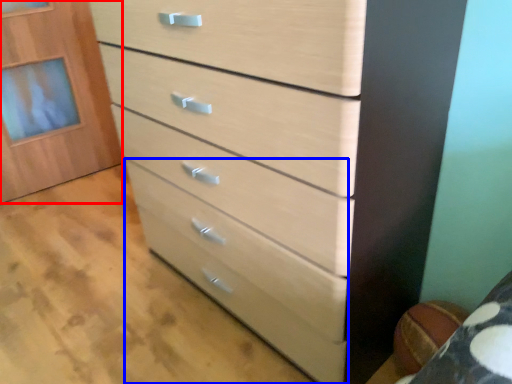
Question: Which object appears farthest to the camera in this image, cabinetry (highlighted by a red box) or drawer (highlighted by a blue box)?

Choices:
 (A) cabinetry
 (B) drawer

Answer: (A)